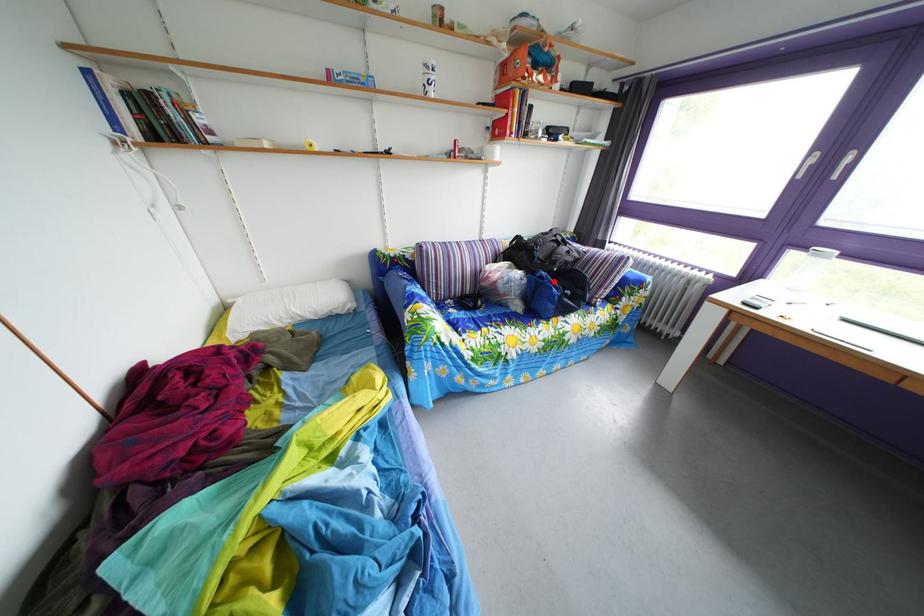
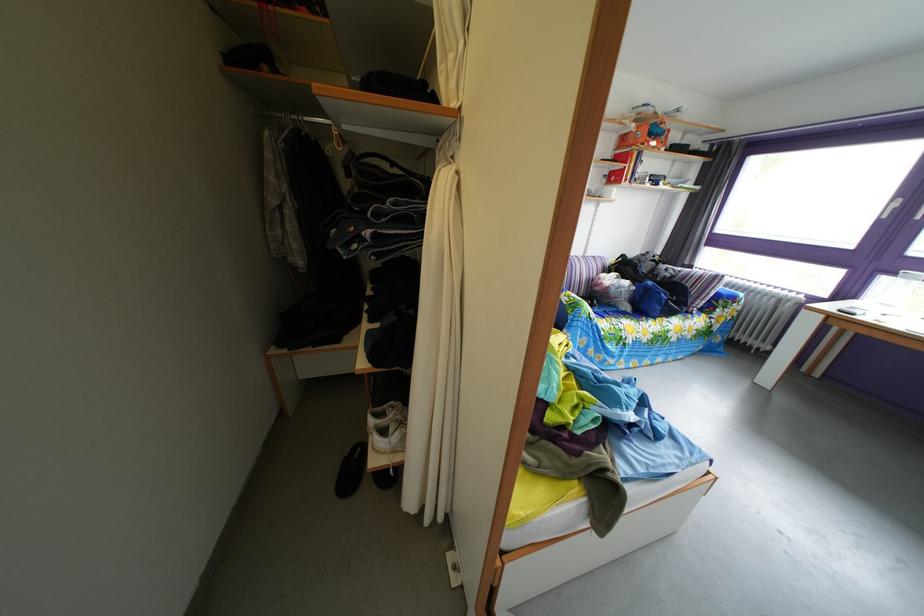
The point at the highlighted location is marked in the first image. Where is the corresponding point in the second image?

(661, 291)